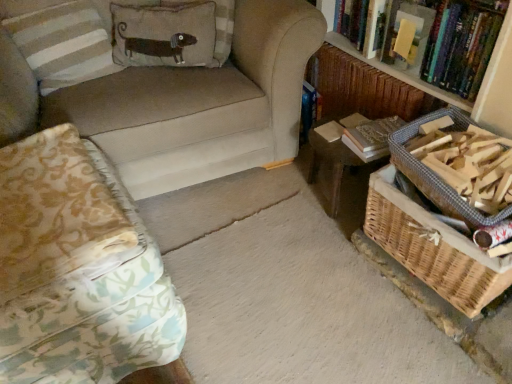
The image size is (512, 384). In order to click on brown fabric pillow with dog design at upper left, the 1th pillow viewed from the right in this screenshot , I will do `click(216, 27)`.

Measure the distance between woven wood table at center and camera.

woven wood table at center and camera are 4.79 feet apart.

Describe the element at coordinates (77, 270) in the screenshot. I see `patterned fabric studio couch at left, which appears as the second studio couch when viewed from the top` at that location.

What is the approximate width of hardcover book at upper right?

The width of hardcover book at upper right is 11.44 inches.

What do you see at coordinates (164, 34) in the screenshot? The width and height of the screenshot is (512, 384). I see `textured beige pillow with dog design at upper left, arranged as the second pillow when viewed from the left` at bounding box center [164, 34].

Where is `brown fabric pillow with dog design at upper left, the third pillow from the left`? The width and height of the screenshot is (512, 384). brown fabric pillow with dog design at upper left, the third pillow from the left is located at coordinates (216, 27).

From the image's perspective, is brown fabric pillow with dog design at upper left, the third pillow from the left, below suede-like beige couch at upper left, the 1th studio couch viewed from the top?

No, from the image's perspective, brown fabric pillow with dog design at upper left, the third pillow from the left, is not below suede-like beige couch at upper left, the 1th studio couch viewed from the top.

Between brown fabric pillow with dog design at upper left, the 1th pillow viewed from the right, and suede-like beige couch at upper left, the 1th studio couch viewed from the top, which one has smaller width?

Thinner between the two is brown fabric pillow with dog design at upper left, the 1th pillow viewed from the right.

Based on the photo, how many degrees apart are the facing directions of brown fabric pillow with dog design at upper left, the 1th pillow viewed from the right, and suede-like beige couch at upper left, positioned as the 2th studio couch in bottom-to-top order?

The angle between the facing direction of brown fabric pillow with dog design at upper left, the 1th pillow viewed from the right, and the facing direction of suede-like beige couch at upper left, positioned as the 2th studio couch in bottom-to-top order, is 147 degrees.

Does brown fabric pillow with dog design at upper left, the 1th pillow viewed from the right, have a larger size compared to suede-like beige couch at upper left, the 1th studio couch viewed from the top?

Incorrect, brown fabric pillow with dog design at upper left, the 1th pillow viewed from the right, is not larger than suede-like beige couch at upper left, the 1th studio couch viewed from the top.

This screenshot has height=384, width=512. In order to click on the 3rd pillow to the left of the woven brown basket at lower right, the first basket positioned from the bottom, counting from the anchor's position in this screenshot , I will do `click(61, 40)`.

From a real-world perspective, is striped fabric pillow at upper left, which appears as the first pillow when viewed from the left, positioned above or below woven brown basket at lower right, the second basket when ordered from top to bottom?

striped fabric pillow at upper left, which appears as the first pillow when viewed from the left, is above woven brown basket at lower right, the second basket when ordered from top to bottom.

Is striped fabric pillow at upper left, which appears as the first pillow when viewed from the left, facing away from woven brown basket at lower right, the second basket when ordered from top to bottom?

No, striped fabric pillow at upper left, which appears as the first pillow when viewed from the left, is not facing away from woven brown basket at lower right, the second basket when ordered from top to bottom.

Does striped fabric pillow at upper left, placed as the 3th pillow when sorted from right to left, appear on the left side of woven brown basket at lower right, the first basket positioned from the bottom?

Yes, striped fabric pillow at upper left, placed as the 3th pillow when sorted from right to left, is to the left of woven brown basket at lower right, the first basket positioned from the bottom.

Identify the location of pillow that is above the textured beige pillow with dog design at upper left, the second pillow in the right-to-left sequence (from the image's perspective). The height and width of the screenshot is (384, 512). (216, 27).

Considering the positions of objects brown fabric pillow with dog design at upper left, the 1th pillow viewed from the right, and textured beige pillow with dog design at upper left, the second pillow in the right-to-left sequence, in the image provided, who is more to the right, brown fabric pillow with dog design at upper left, the 1th pillow viewed from the right, or textured beige pillow with dog design at upper left, the second pillow in the right-to-left sequence,?

Positioned to the right is brown fabric pillow with dog design at upper left, the 1th pillow viewed from the right.

From a real-world perspective, is brown fabric pillow with dog design at upper left, the third pillow from the left, beneath textured beige pillow with dog design at upper left, arranged as the second pillow when viewed from the left?

Correct, in the physical world, brown fabric pillow with dog design at upper left, the third pillow from the left, is lower than textured beige pillow with dog design at upper left, arranged as the second pillow when viewed from the left.

Can you confirm if brown fabric pillow with dog design at upper left, the 1th pillow viewed from the right, is shorter than textured beige pillow with dog design at upper left, the second pillow in the right-to-left sequence?

No, brown fabric pillow with dog design at upper left, the 1th pillow viewed from the right, is not shorter than textured beige pillow with dog design at upper left, the second pillow in the right-to-left sequence.

Looking at the image, does patterned fabric studio couch at left, placed as the 1th studio couch when sorted from bottom to top, seem bigger or smaller compared to woven brown basket at lower right, the second basket when ordered from top to bottom?

Considering their sizes, patterned fabric studio couch at left, placed as the 1th studio couch when sorted from bottom to top, takes up more space than woven brown basket at lower right, the second basket when ordered from top to bottom.

Is patterned fabric studio couch at left, placed as the 1th studio couch when sorted from bottom to top, spatially inside woven brown basket at lower right, the first basket positioned from the bottom, or outside of it?

patterned fabric studio couch at left, placed as the 1th studio couch when sorted from bottom to top, lies outside woven brown basket at lower right, the first basket positioned from the bottom.

Between patterned fabric studio couch at left, placed as the 1th studio couch when sorted from bottom to top, and woven brown basket at lower right, the first basket positioned from the bottom, which one appears on the right side from the viewer's perspective?

woven brown basket at lower right, the first basket positioned from the bottom.

From a real-world perspective, is patterned fabric studio couch at left, which appears as the second studio couch when viewed from the top, positioned above or below woven brown basket at lower right, the second basket when ordered from top to bottom?

patterned fabric studio couch at left, which appears as the second studio couch when viewed from the top, is situated higher than woven brown basket at lower right, the second basket when ordered from top to bottom, in the real world.

Can woven wood table at center be found inside textured beige pillow with dog design at upper left, arranged as the second pillow when viewed from the left?

That's incorrect, woven wood table at center is not inside textured beige pillow with dog design at upper left, arranged as the second pillow when viewed from the left.

In the scene shown: Considering the relative sizes of textured beige pillow with dog design at upper left, arranged as the second pillow when viewed from the left, and woven wood table at center in the image provided, is textured beige pillow with dog design at upper left, arranged as the second pillow when viewed from the left, smaller than woven wood table at center?

Yes, textured beige pillow with dog design at upper left, arranged as the second pillow when viewed from the left, is smaller than woven wood table at center.

Where is `table in front of the textured beige pillow with dog design at upper left, the second pillow in the right-to-left sequence`? The height and width of the screenshot is (384, 512). table in front of the textured beige pillow with dog design at upper left, the second pillow in the right-to-left sequence is located at coordinates (348, 148).

From a real-world perspective, is textured beige pillow with dog design at upper left, arranged as the second pillow when viewed from the left, positioned over woven wood table at center based on gravity?

Yes, from a real-world perspective, textured beige pillow with dog design at upper left, arranged as the second pillow when viewed from the left, is over woven wood table at center

Who is bigger, textured beige pillow with dog design at upper left, the second pillow in the right-to-left sequence, or woven brown basket at lower right, the first basket positioned from the bottom?

woven brown basket at lower right, the first basket positioned from the bottom.

Is textured beige pillow with dog design at upper left, the second pillow in the right-to-left sequence, looking in the opposite direction of woven brown basket at lower right, the first basket positioned from the bottom?

No, woven brown basket at lower right, the first basket positioned from the bottom, is not at the back of textured beige pillow with dog design at upper left, the second pillow in the right-to-left sequence.

Does point (204, 43) come behind point (410, 199)?

Yes, point (204, 43) is behind point (410, 199).

Is suede-like beige couch at upper left, positioned as the 2th studio couch in bottom-to-top order, spatially inside hardcover book at upper right, or outside of it?

suede-like beige couch at upper left, positioned as the 2th studio couch in bottom-to-top order, cannot be found inside hardcover book at upper right.

From a real-world perspective, which object stands above the other?

hardcover book at upper right is physically above.

Considering the relative positions of suede-like beige couch at upper left, positioned as the 2th studio couch in bottom-to-top order, and hardcover book at upper right in the image provided, is suede-like beige couch at upper left, positioned as the 2th studio couch in bottom-to-top order, behind hardcover book at upper right?

No, suede-like beige couch at upper left, positioned as the 2th studio couch in bottom-to-top order, is in front of hardcover book at upper right.

Between suede-like beige couch at upper left, positioned as the 2th studio couch in bottom-to-top order, and hardcover book at upper right, which one has less height?

With less height is hardcover book at upper right.

Where is `the 1st pillow above the suede-like beige couch at upper left, the 1th studio couch viewed from the top (from a real-world perspective)`? the 1st pillow above the suede-like beige couch at upper left, the 1th studio couch viewed from the top (from a real-world perspective) is located at coordinates (216, 27).

You are a GUI agent. You are given a task and a screenshot of the screen. Output one action in this format:
    pyautogui.click(x=<x>, y=<y>)
    Task: Click on the 1st pillow behind the woven brown basket at lower right, the first basket positioned from the bottom
    This screenshot has height=384, width=512.
    Given the screenshot: What is the action you would take?
    pyautogui.click(x=61, y=40)

Considering their positions, is striped fabric pillow at upper left, which appears as the first pillow when viewed from the left, positioned closer to hardcover book at center right than patterned fabric studio couch at left, placed as the 1th studio couch when sorted from bottom to top?

patterned fabric studio couch at left, placed as the 1th studio couch when sorted from bottom to top, lies closer to hardcover book at center right than the other object.

Looking at the image, which one is located further to striped fabric pillow at upper left, which appears as the first pillow when viewed from the left, brown fabric pillow with dog design at upper left, the 1th pillow viewed from the right, or woven wood table at center?

Among the two, woven wood table at center is located further to striped fabric pillow at upper left, which appears as the first pillow when viewed from the left.

Based on their spatial positions, is woven wood table at center or suede-like beige couch at upper left, positioned as the 2th studio couch in bottom-to-top order, further from textured beige pillow with dog design at upper left, arranged as the second pillow when viewed from the left?

Among the two, woven wood table at center is located further to textured beige pillow with dog design at upper left, arranged as the second pillow when viewed from the left.

Based on their spatial positions, is hardcover book at upper right or patterned fabric studio couch at left, placed as the 1th studio couch when sorted from bottom to top, closer to suede-like beige couch at upper left, the 1th studio couch viewed from the top?

Among the two, patterned fabric studio couch at left, placed as the 1th studio couch when sorted from bottom to top, is located nearer to suede-like beige couch at upper left, the 1th studio couch viewed from the top.

Estimate the real-world distances between objects in this image. Which object is further from brown fabric pillow with dog design at upper left, the 1th pillow viewed from the right, hardcover book at center right or woven wood table at center?

Based on the image, hardcover book at center right appears to be further to brown fabric pillow with dog design at upper left, the 1th pillow viewed from the right.

From the image, which object appears to be nearer to hardcover book at center right, textured beige pillow with dog design at upper left, the second pillow in the right-to-left sequence, or woven wood table at center?

Based on the image, woven wood table at center appears to be nearer to hardcover book at center right.

Looking at the image, which one is located closer to hardcover book at upper right, woven wood basket at lower right, which is the 1th basket from top to bottom, or woven wood table at center?

Among the two, woven wood basket at lower right, which is the 1th basket from top to bottom, is located nearer to hardcover book at upper right.

Considering their positions, is woven wood table at center positioned further to suede-like beige couch at upper left, positioned as the 2th studio couch in bottom-to-top order, than patterned fabric studio couch at left, placed as the 1th studio couch when sorted from bottom to top?

woven wood table at center.

This screenshot has height=384, width=512. I want to click on paperback book located between suede-like beige couch at upper left, the 1th studio couch viewed from the top, and woven wood basket at lower right, which appears as the 2th basket when ordered from the bottom, in the left-right direction, so click(x=373, y=133).

Where is `paperback book located between suede-like beige couch at upper left, the 1th studio couch viewed from the top, and woven brown basket at lower right, the first basket positioned from the bottom, in the left-right direction`? paperback book located between suede-like beige couch at upper left, the 1th studio couch viewed from the top, and woven brown basket at lower right, the first basket positioned from the bottom, in the left-right direction is located at coordinates (373, 133).

At what (x,y) coordinates should I click in order to perform the action: click on table located between brown fabric pillow with dog design at upper left, the 1th pillow viewed from the right, and woven wood basket at lower right, which is the 1th basket from top to bottom, in the left-right direction. Please return your answer as a coordinate pair (x, y). This screenshot has height=384, width=512. Looking at the image, I should click on (348, 148).

Locate an element on the screen. This screenshot has width=512, height=384. book between brown fabric pillow with dog design at upper left, the third pillow from the left, and woven wood basket at lower right, which is the 1th basket from top to bottom, in the horizontal direction is located at coordinates (429, 37).